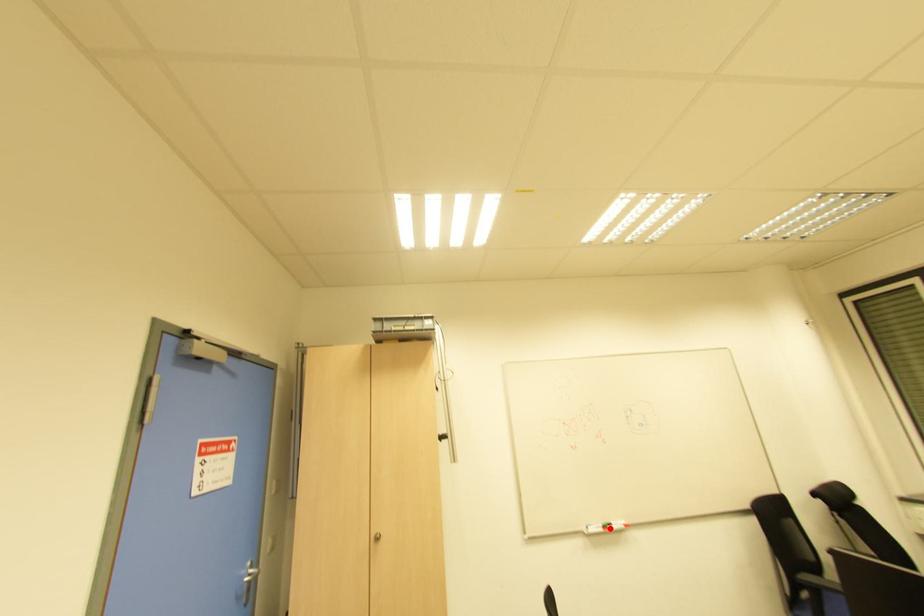
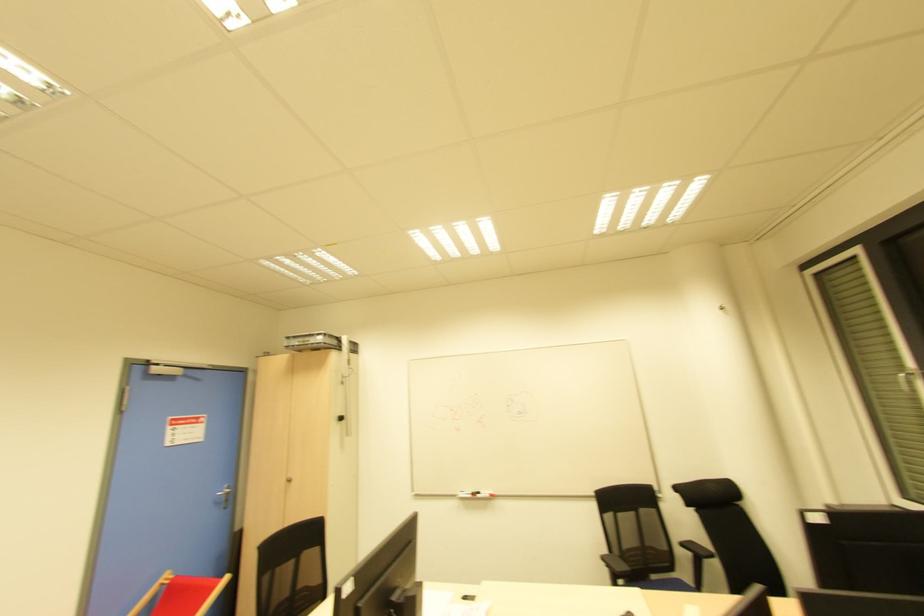
In the second image, find the point that corresponds to the highlighted location in the first image.

(478, 496)